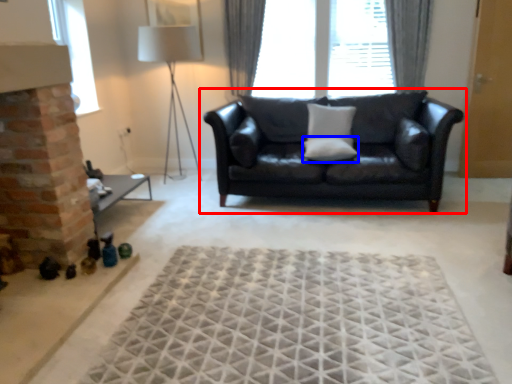
Question: Which of the following is the farthest to the observer, studio couch (highlighted by a red box) or pillow (highlighted by a blue box)?

Choices:
 (A) studio couch
 (B) pillow

Answer: (B)